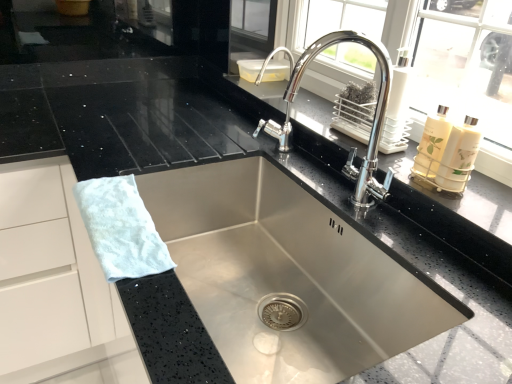
Question: Does polished chrome faucet at upper center lie in front of white fluffy hand towel at left?

Choices:
 (A) no
 (B) yes

Answer: (A)

Question: Is polished chrome faucet at upper center to the left of white fluffy hand towel at left from the viewer's perspective?

Choices:
 (A) no
 (B) yes

Answer: (A)

Question: Considering the relative sizes of polished chrome faucet at upper center and white fluffy hand towel at left in the image provided, is polished chrome faucet at upper center bigger than white fluffy hand towel at left?

Choices:
 (A) yes
 (B) no

Answer: (A)

Question: From the image's perspective, does polished chrome faucet at upper center appear lower than white fluffy hand towel at left?

Choices:
 (A) no
 (B) yes

Answer: (A)

Question: Would you say polished chrome faucet at upper center contains white fluffy hand towel at left?

Choices:
 (A) yes
 (B) no

Answer: (B)

Question: Can you confirm if polished chrome faucet at upper center is positioned to the right of white fluffy hand towel at left?

Choices:
 (A) no
 (B) yes

Answer: (B)

Question: Is polished chrome faucet at upper center facing away from stainless steel sink at center?

Choices:
 (A) no
 (B) yes

Answer: (A)

Question: Does polished chrome faucet at upper center appear on the right side of stainless steel sink at center?

Choices:
 (A) no
 (B) yes

Answer: (B)

Question: From the image's perspective, is polished chrome faucet at upper center under stainless steel sink at center?

Choices:
 (A) no
 (B) yes

Answer: (A)

Question: Does polished chrome faucet at upper center have a lesser height compared to stainless steel sink at center?

Choices:
 (A) no
 (B) yes

Answer: (B)

Question: From a real-world perspective, does polished chrome faucet at upper center stand above stainless steel sink at center?

Choices:
 (A) yes
 (B) no

Answer: (A)

Question: From the image's perspective, is polished chrome faucet at upper center above stainless steel sink at center?

Choices:
 (A) no
 (B) yes

Answer: (B)

Question: Can you confirm if stainless steel sink at center is shorter than polished chrome faucet at upper center?

Choices:
 (A) yes
 (B) no

Answer: (B)